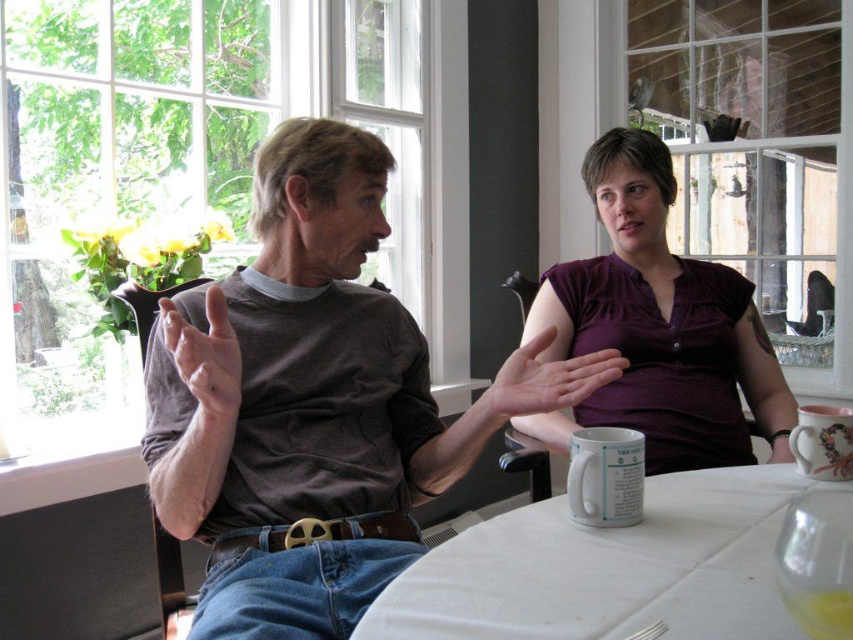
Measure the distance between white fabric table at center and camera.

A distance of 72.43 centimeters exists between white fabric table at center and camera.

Who is lower down, white fabric table at center or purple cotton shirt at upper right?

white fabric table at center is lower down.

Measure the distance between white fabric table at center and camera.

The distance of white fabric table at center from camera is 72.43 centimeters.

What are the coordinates of `white fabric table at center` in the screenshot? It's located at (608, 568).

Between brown cotton shirt at left and purple cotton shirt at upper right, which one appears on the left side from the viewer's perspective?

brown cotton shirt at left

Who is taller, brown cotton shirt at left or purple cotton shirt at upper right?

purple cotton shirt at upper right

Who is more forward, (325,401) or (782,384)?

Point (325,401) is in front.

I want to click on brown cotton shirt at left, so click(x=314, y=403).

Which of these two, brown cotton shirt at left or white fabric table at center, stands shorter?

Standing shorter between the two is white fabric table at center.

Which is above, brown cotton shirt at left or white fabric table at center?

brown cotton shirt at left is above.

Where is `brown cotton shirt at left`? Image resolution: width=853 pixels, height=640 pixels. brown cotton shirt at left is located at coordinates (314, 403).